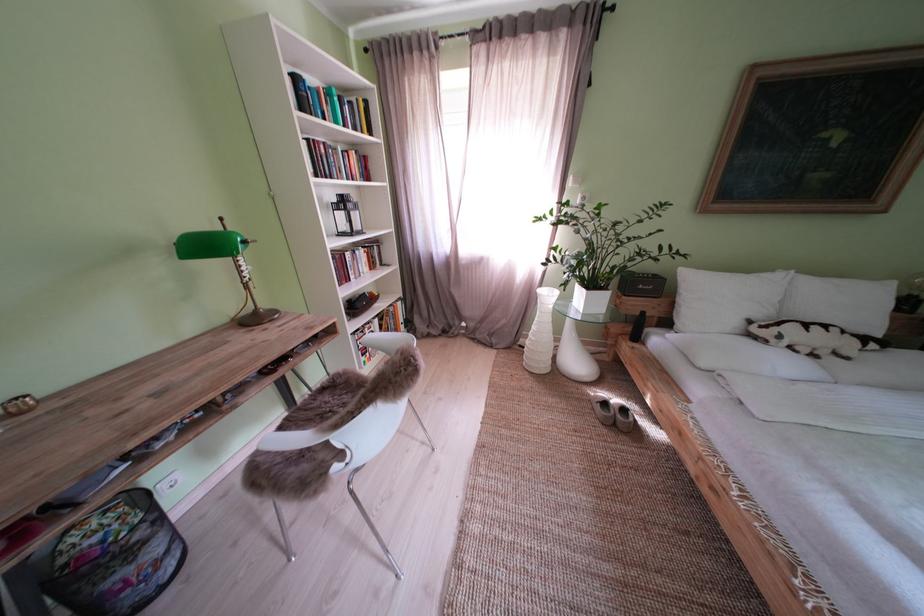
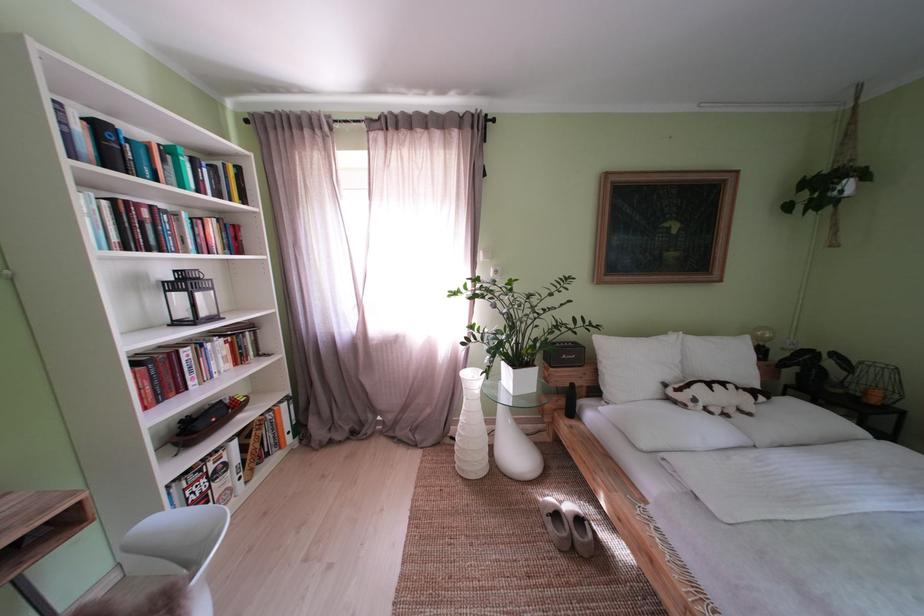
In the second image, find the point that corresponds to the point at 784,276 in the first image.

(675, 338)